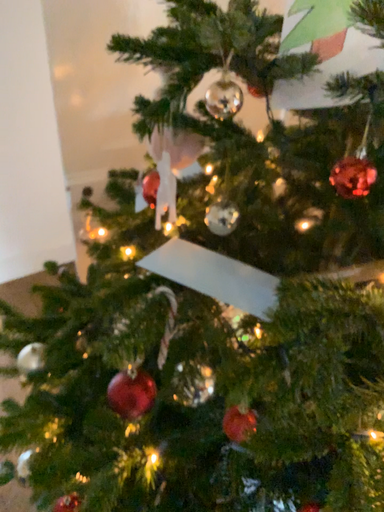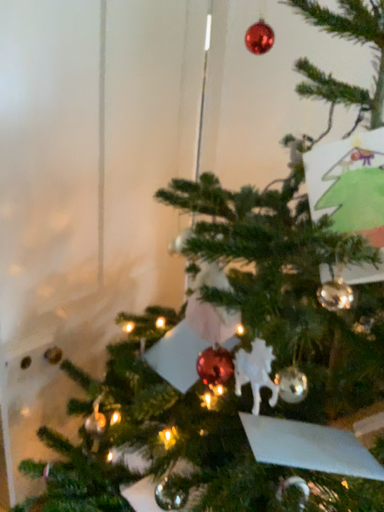
Question: Which way did the camera rotate in the video?

Choices:
 (A) rotated downward
 (B) rotated upward

Answer: (B)